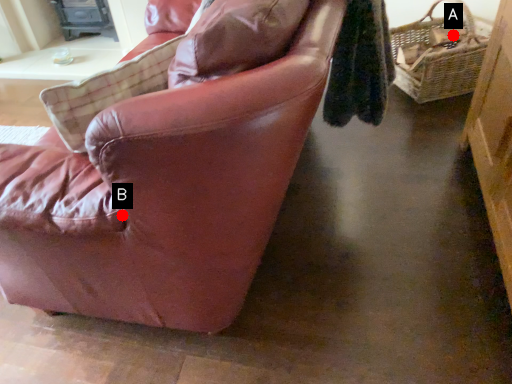
Question: Two points are circled on the image, labeled by A and B beside each circle. Which point appears closest to the camera in this image?

Choices:
 (A) A is closer
 (B) B is closer

Answer: (B)